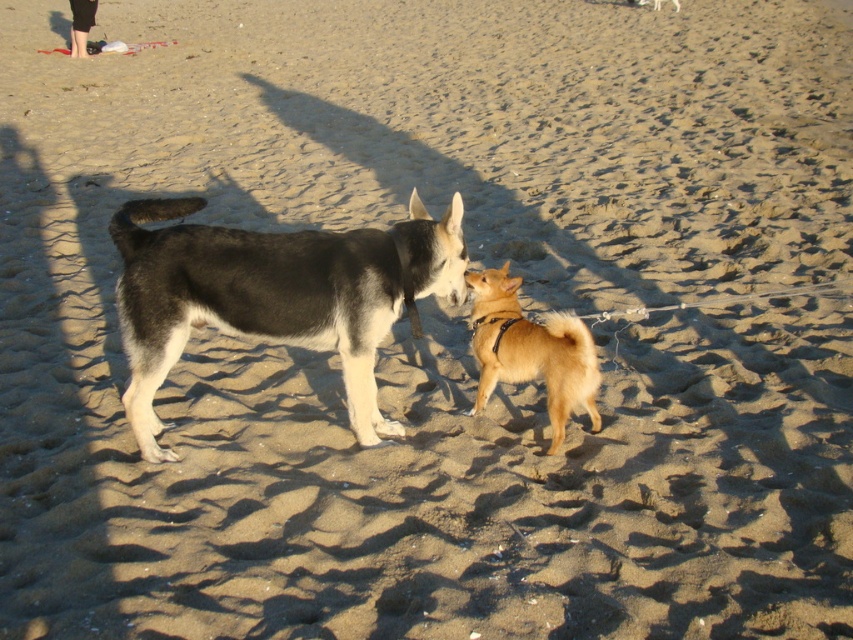
Question: Which of the following is the farthest from the observer?

Choices:
 (A) (85, 3)
 (B) (509, 310)
 (C) (267, 336)

Answer: (A)

Question: Where is black and white fur dog at center located in relation to golden fur dog at center in the image?

Choices:
 (A) above
 (B) below

Answer: (A)

Question: Is black and white fur dog at center below golden fur dog at center?

Choices:
 (A) yes
 (B) no

Answer: (B)

Question: Which of the following is the farthest from the observer?

Choices:
 (A) black leather pants at upper left
 (B) golden fur dog at center
 (C) black and white fur dog at center

Answer: (A)

Question: Is black and white fur dog at center smaller than black leather pants at upper left?

Choices:
 (A) yes
 (B) no

Answer: (B)

Question: Which of the following is the closest to the observer?

Choices:
 (A) (260, 328)
 (B) (80, 38)
 (C) (509, 304)

Answer: (A)